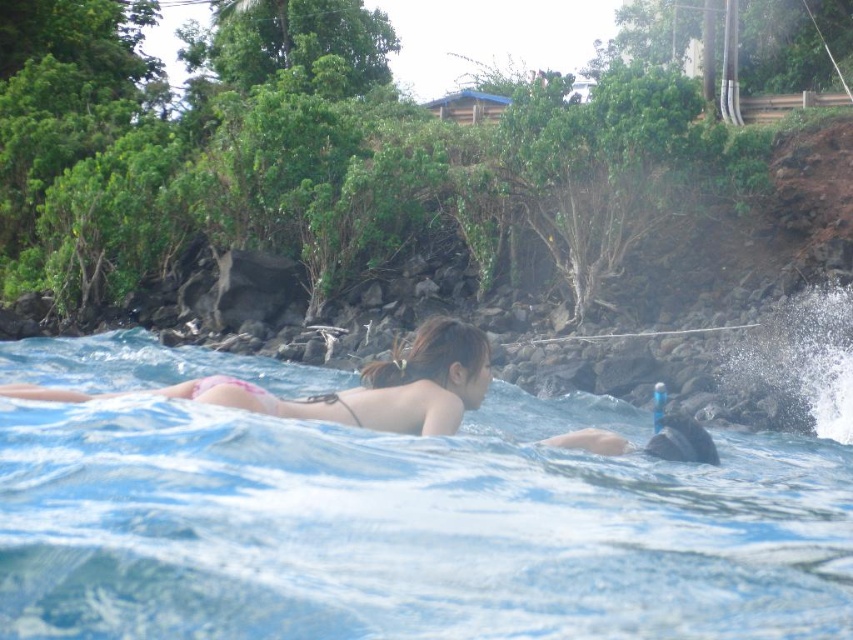
You are standing at the shoreline and want to reach the small building with the blue roof located at point (474,396). There is a person at point (546,518) in the water. Which direction should you move relative to the person to reach the building?

To reach the small building with the blue roof at point (474,396), you should move behind the person at point (546,518) since the building is behind them according to their position.

What is the exact coordinate of the clear blue water at center?

The clear blue water at center is located at point (425, 522).

Looking at this image, you are a swimmer who wants to avoid getting your bikini wet. You see the clear blue water at center and the pink bikini at center in the image. Which object is located below the other?

The clear blue water at center is positioned under the pink bikini at center, so the water is below the bikini.